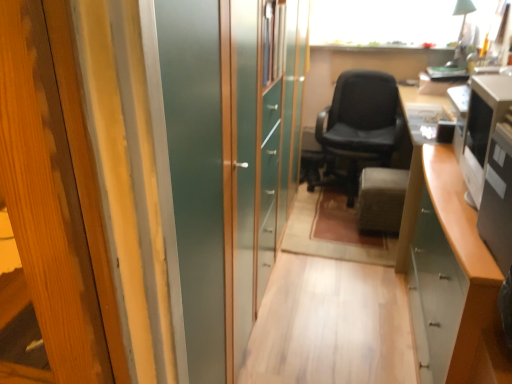
Find the location of a particular element. black glossy desktop computer at right, which is the 1th desktop computer in front-to-back order is located at coordinates (498, 200).

This screenshot has width=512, height=384. What do you see at coordinates (381, 199) in the screenshot?
I see `velvet gray ottoman at center` at bounding box center [381, 199].

The image size is (512, 384). Find the location of `white glossy cabinet at lower right`. white glossy cabinet at lower right is located at coordinates (451, 280).

From their relative heights in the image, would you say velvet gray ottoman at center is taller or shorter than white glossy cabinet at lower right?

velvet gray ottoman at center is shorter than white glossy cabinet at lower right.

How different are the orientations of velvet gray ottoman at center and white glossy cabinet at lower right in degrees?

The facing directions of velvet gray ottoman at center and white glossy cabinet at lower right are 91.6 degrees apart.

Is velvet gray ottoman at center outside of white glossy cabinet at lower right?

Absolutely, velvet gray ottoman at center is external to white glossy cabinet at lower right.

In the image, is velvet gray ottoman at center on the left side or the right side of white glossy cabinet at lower right?

velvet gray ottoman at center is positioned on white glossy cabinet at lower right's left side.

Which object is positioned more to the left, black glossy desktop computer at right, which is counted as the 2th desktop computer, starting from the back, or white glossy cabinet at lower right?

black glossy desktop computer at right, which is counted as the 2th desktop computer, starting from the back, is more to the left.

Is black glossy desktop computer at right, which is the 1th desktop computer in front-to-back order, behind white glossy cabinet at lower right?

No, black glossy desktop computer at right, which is the 1th desktop computer in front-to-back order, is closer to the viewer.

From the image's perspective, is black glossy desktop computer at right, which is the 1th desktop computer in front-to-back order, below white glossy cabinet at lower right?

Actually, black glossy desktop computer at right, which is the 1th desktop computer in front-to-back order, appears above white glossy cabinet at lower right in the image.

Can we say black glossy desktop computer at right, which is counted as the 2th desktop computer, starting from the back, lies outside white glossy cabinet at lower right?

Yes.

How different are the orientations of satin silver monitor at right, the 2th desktop computer viewed from the front, and black glossy desktop computer at right, which is the 1th desktop computer in front-to-back order, in degrees?

There is a 6.03-degree angle between the facing directions of satin silver monitor at right, the 2th desktop computer viewed from the front, and black glossy desktop computer at right, which is the 1th desktop computer in front-to-back order.

Which is less distant, (486, 114) or (507, 164)?

Point (486, 114) is positioned farther from the camera compared to point (507, 164).

Between satin silver monitor at right, positioned as the 1th desktop computer in back-to-front order, and black glossy desktop computer at right, which is the 1th desktop computer in front-to-back order, which one has less height?

black glossy desktop computer at right, which is the 1th desktop computer in front-to-back order.

Visually, is satin silver monitor at right, positioned as the 1th desktop computer in back-to-front order, positioned to the left or to the right of black glossy desktop computer at right, which is counted as the 2th desktop computer, starting from the back?

Based on their positions, satin silver monitor at right, positioned as the 1th desktop computer in back-to-front order, is located to the right of black glossy desktop computer at right, which is counted as the 2th desktop computer, starting from the back.

Who is shorter, satin silver monitor at right, the 2th desktop computer viewed from the front, or velvet gray ottoman at center?

velvet gray ottoman at center.

Considering the relative sizes of satin silver monitor at right, the 2th desktop computer viewed from the front, and velvet gray ottoman at center in the image provided, is satin silver monitor at right, the 2th desktop computer viewed from the front, smaller than velvet gray ottoman at center?

Indeed, satin silver monitor at right, the 2th desktop computer viewed from the front, has a smaller size compared to velvet gray ottoman at center.

Is point (471, 130) positioned after point (400, 214)?

No, it is in front of (400, 214).

From the image's perspective, which one is positioned lower, satin silver monitor at right, the 2th desktop computer viewed from the front, or velvet gray ottoman at center?

velvet gray ottoman at center, from the image's perspective.

Which object is wider, black glossy desktop computer at right, which is the 1th desktop computer in front-to-back order, or black leather chair at center?

black leather chair at center is wider.

Is black glossy desktop computer at right, which is the 1th desktop computer in front-to-back order, to the left or to the right of black leather chair at center in the image?

Clearly, black glossy desktop computer at right, which is the 1th desktop computer in front-to-back order, is on the left of black leather chair at center in the image.

Considering the positions of objects black glossy desktop computer at right, which is the 1th desktop computer in front-to-back order, and black leather chair at center in the image provided, who is in front, black glossy desktop computer at right, which is the 1th desktop computer in front-to-back order, or black leather chair at center?

black glossy desktop computer at right, which is the 1th desktop computer in front-to-back order, is more forward.

Considering the positions of point (505, 259) and point (354, 174), is point (505, 259) closer or farther from the camera than point (354, 174)?

Clearly, point (505, 259) is closer to the camera than point (354, 174).

Considering the relative sizes of black leather chair at center and velvet gray ottoman at center in the image provided, is black leather chair at center bigger than velvet gray ottoman at center?

Yes.

Is point (356, 72) positioned behind point (400, 201)?

That is True.

Considering the positions of objects black leather chair at center and velvet gray ottoman at center in the image provided, who is in front, black leather chair at center or velvet gray ottoman at center?

velvet gray ottoman at center is closer to the camera.

Is black leather chair at center wider or thinner than velvet gray ottoman at center?

In the image, black leather chair at center appears to be wider than velvet gray ottoman at center.

Is point (341, 149) farther from camera compared to point (439, 360)?

Yes, it is behind point (439, 360).

Considering their positions, is black leather chair at center located in front of or behind white glossy cabinet at lower right?

In the image, black leather chair at center appears behind white glossy cabinet at lower right.

Consider the image. Does black leather chair at center have a larger size compared to white glossy cabinet at lower right?

Actually, black leather chair at center might be smaller than white glossy cabinet at lower right.

Which object is wider, black leather chair at center or white glossy cabinet at lower right?

black leather chair at center is wider.

Find the location of a particular element. This screenshot has width=512, height=384. cabinetry below the velvet gray ottoman at center (from the image's perspective) is located at coordinates (451, 280).

Starting from the white glossy cabinet at lower right, which desktop computer is the 2nd one to the left? Please provide its 2D coordinates.

[(498, 200)]

In the scene shown: When comparing their distances from black glossy desktop computer at right, which is counted as the 2th desktop computer, starting from the back, does white glossy cabinet at lower right or black leather chair at center seem further?

Among the two, black leather chair at center is located further to black glossy desktop computer at right, which is counted as the 2th desktop computer, starting from the back.

When comparing their distances from black glossy desktop computer at right, which is counted as the 2th desktop computer, starting from the back, does velvet gray ottoman at center or satin silver monitor at right, the 2th desktop computer viewed from the front, seem further?

velvet gray ottoman at center is further to black glossy desktop computer at right, which is counted as the 2th desktop computer, starting from the back.

Consider the image. Considering their positions, is black glossy desktop computer at right, which is counted as the 2th desktop computer, starting from the back, positioned further to satin silver monitor at right, positioned as the 1th desktop computer in back-to-front order, than velvet gray ottoman at center?

velvet gray ottoman at center is further to satin silver monitor at right, positioned as the 1th desktop computer in back-to-front order.

Based on their spatial positions, is black glossy desktop computer at right, which is counted as the 2th desktop computer, starting from the back, or white glossy cabinet at lower right closer to satin silver monitor at right, the 2th desktop computer viewed from the front?

white glossy cabinet at lower right.

Based on their spatial positions, is satin silver monitor at right, the 2th desktop computer viewed from the front, or velvet gray ottoman at center further from black glossy desktop computer at right, which is counted as the 2th desktop computer, starting from the back?

velvet gray ottoman at center is further to black glossy desktop computer at right, which is counted as the 2th desktop computer, starting from the back.

Which object lies further to the anchor point black glossy desktop computer at right, which is the 1th desktop computer in front-to-back order, satin silver monitor at right, positioned as the 1th desktop computer in back-to-front order, or black leather chair at center?

Among the two, black leather chair at center is located further to black glossy desktop computer at right, which is the 1th desktop computer in front-to-back order.

When comparing their distances from white glossy cabinet at lower right, does black leather chair at center or black glossy desktop computer at right, which is the 1th desktop computer in front-to-back order, seem closer?

The object closer to white glossy cabinet at lower right is black glossy desktop computer at right, which is the 1th desktop computer in front-to-back order.

Based on their spatial positions, is white glossy cabinet at lower right or black leather chair at center closer to velvet gray ottoman at center?

black leather chair at center lies closer to velvet gray ottoman at center than the other object.

Locate an element on the screen. The image size is (512, 384). desktop computer positioned between white glossy cabinet at lower right and velvet gray ottoman at center from near to far is located at coordinates (482, 128).

Where is `furniture between satin silver monitor at right, the 2th desktop computer viewed from the front, and black leather chair at center in the front-back direction`? The height and width of the screenshot is (384, 512). furniture between satin silver monitor at right, the 2th desktop computer viewed from the front, and black leather chair at center in the front-back direction is located at coordinates (381, 199).

I want to click on furniture positioned between black glossy desktop computer at right, which is the 1th desktop computer in front-to-back order, and black leather chair at center from near to far, so click(x=381, y=199).

Locate an element on the screen. Image resolution: width=512 pixels, height=384 pixels. desktop computer between black glossy desktop computer at right, which is the 1th desktop computer in front-to-back order, and velvet gray ottoman at center from front to back is located at coordinates (482, 128).